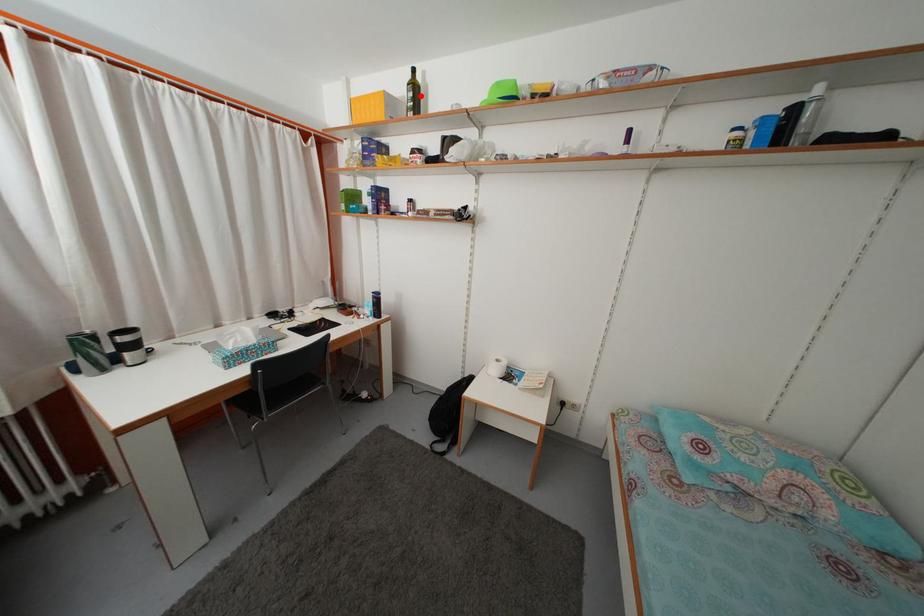
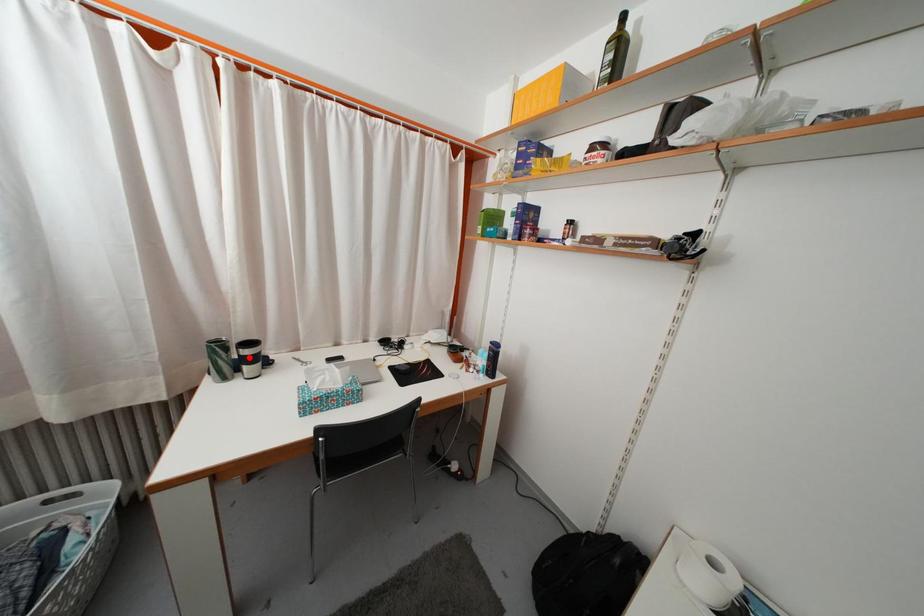
I am providing you with two images of the same scene from different viewpoints. A red point is marked on the first image and another point is marked on the second image. Is the marked point in image1 the same physical position as the marked point in image2?

No